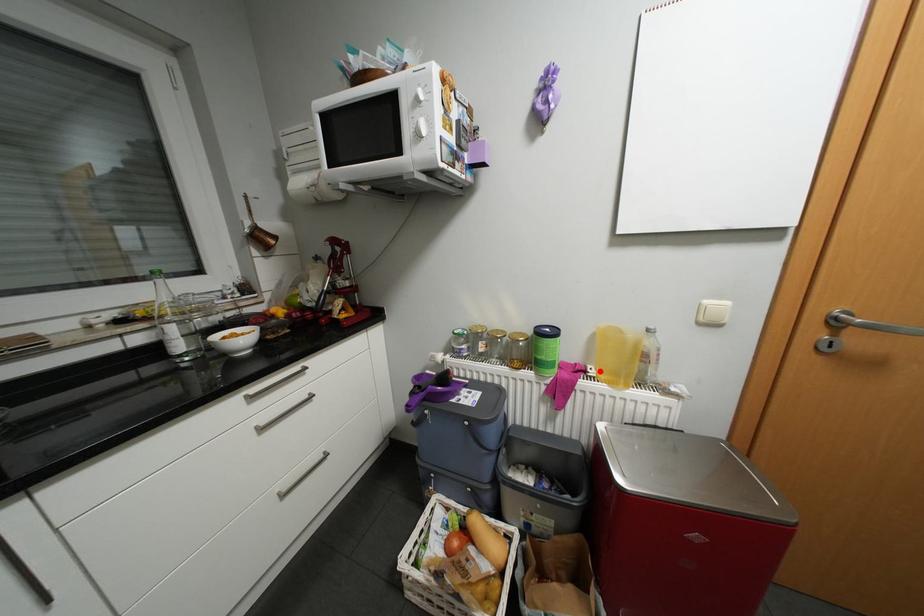
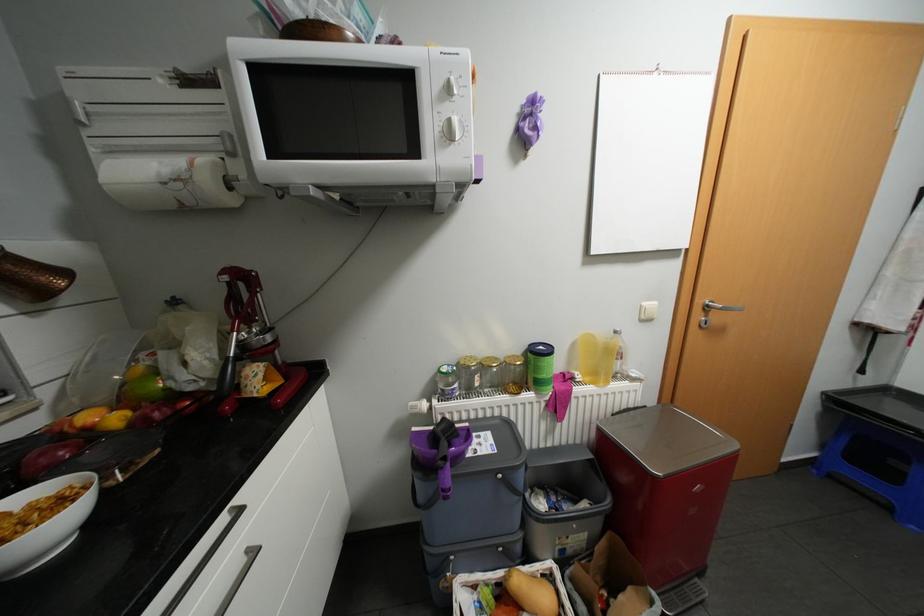
Find the pixel in the second image that matches the highlighted location in the first image.

(587, 377)